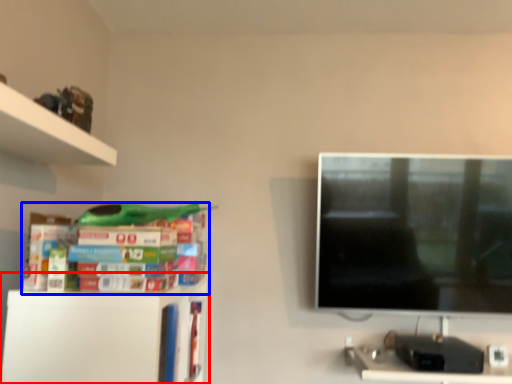
Question: Which object is closer to the camera taking this photo, shelf (highlighted by a red box) or book (highlighted by a blue box)?

Choices:
 (A) shelf
 (B) book

Answer: (B)